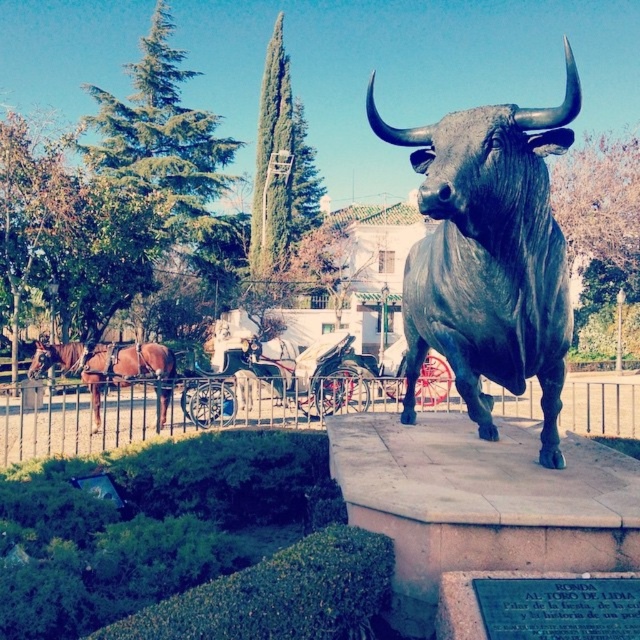
You are standing at point (436, 150) and want to reach the bronze statue of a bull on the raised stone pedestal. The statue is 3.59 meters away from your current position. If you walk straight towards the statue, will you encounter any obstacles between your starting point and the statue?

The distance between you and the bronze statue of a bull is 3.59 meters. Since the path is clear with only the statue and the trimmed hedge in the foreground, there are no obstacles blocking your straight path to the statue.

You are standing in front of the bronze statue of a bull in the park. You notice two points marked on the statue. The first point is at coordinate point (499,326) and the second point is at coordinate point (54,356). Which point is closer to you?

Point (499,326) is closer to the camera than point (54,356).